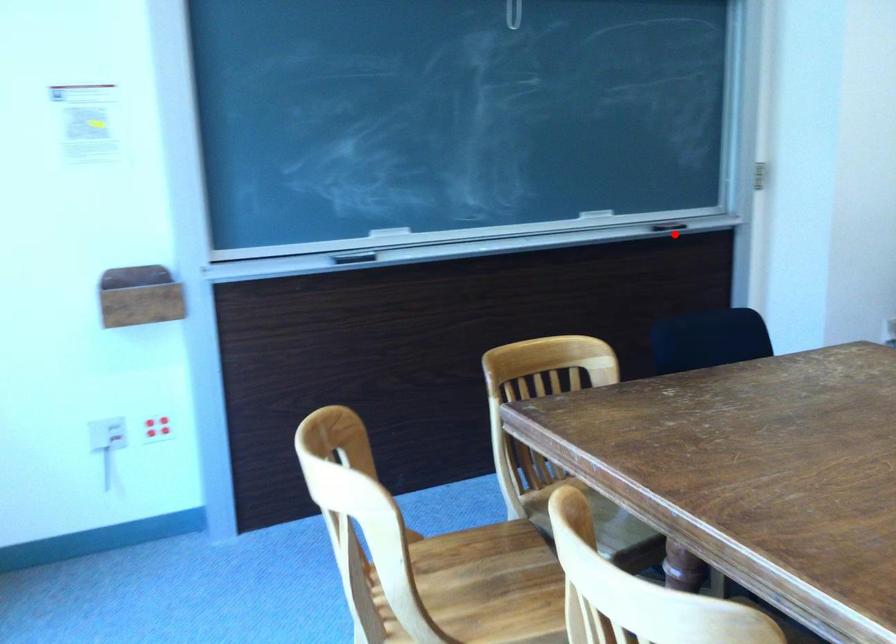
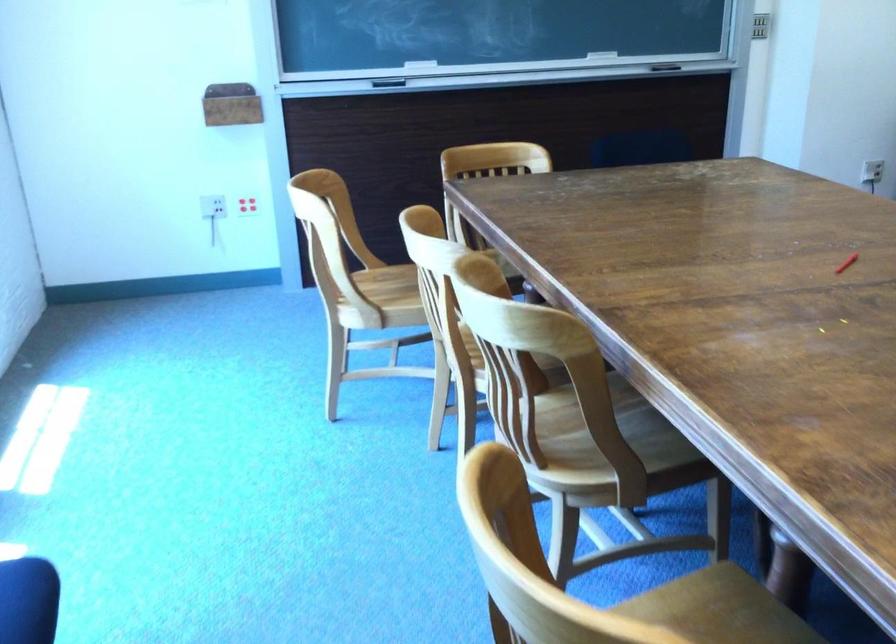
Question: I am providing you with two images of the same scene from different viewpoints. A red point is shown in image1. For the corresponding object point in image2, is it positioned nearer or farther from the camera?

Choices:
 (A) Nearer
 (B) Farther

Answer: (B)